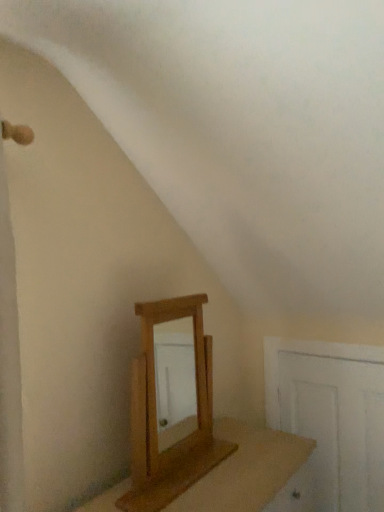
Question: In terms of width, does light brown wooden mirror at center look wider or thinner when compared to white wooden door at lower right?

Choices:
 (A) wide
 (B) thin

Answer: (A)

Question: Based on their sizes in the image, would you say light brown wooden mirror at center is bigger or smaller than white wooden door at lower right?

Choices:
 (A) big
 (B) small

Answer: (A)

Question: Which of these objects is positioned closest to the white wooden door at lower right?

Choices:
 (A) light brown wooden mirror at center
 (B) wooden table at center

Answer: (B)

Question: Which of these objects is positioned closest to the light brown wooden mirror at center?

Choices:
 (A) white wooden door at lower right
 (B) wooden table at center

Answer: (B)